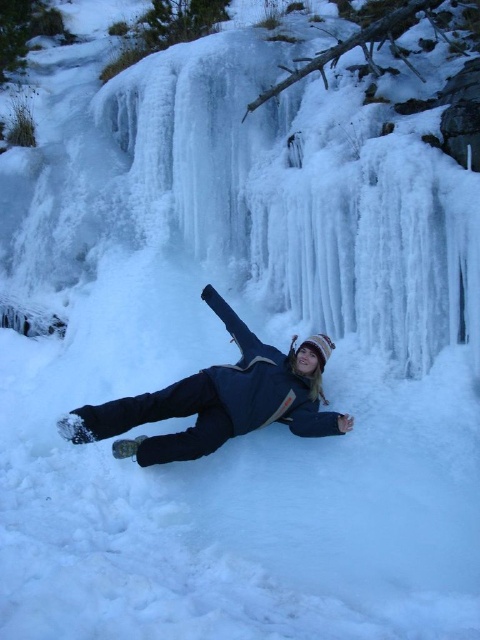
Is icy translucent waterfall at upper center below blue fabric person at center?

No.

Is icy translucent waterfall at upper center above blue fabric person at center?

Yes, icy translucent waterfall at upper center is above blue fabric person at center.

The height and width of the screenshot is (640, 480). What do you see at coordinates (303, 196) in the screenshot?
I see `icy translucent waterfall at upper center` at bounding box center [303, 196].

Where is `icy translucent waterfall at upper center`? icy translucent waterfall at upper center is located at coordinates (303, 196).